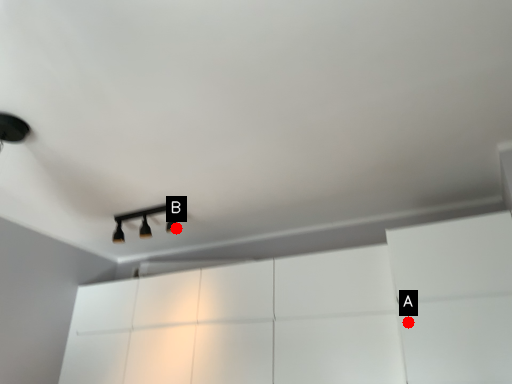
Question: Two points are circled on the image, labeled by A and B beside each circle. Which point is closer to the camera?

Choices:
 (A) A is closer
 (B) B is closer

Answer: (A)